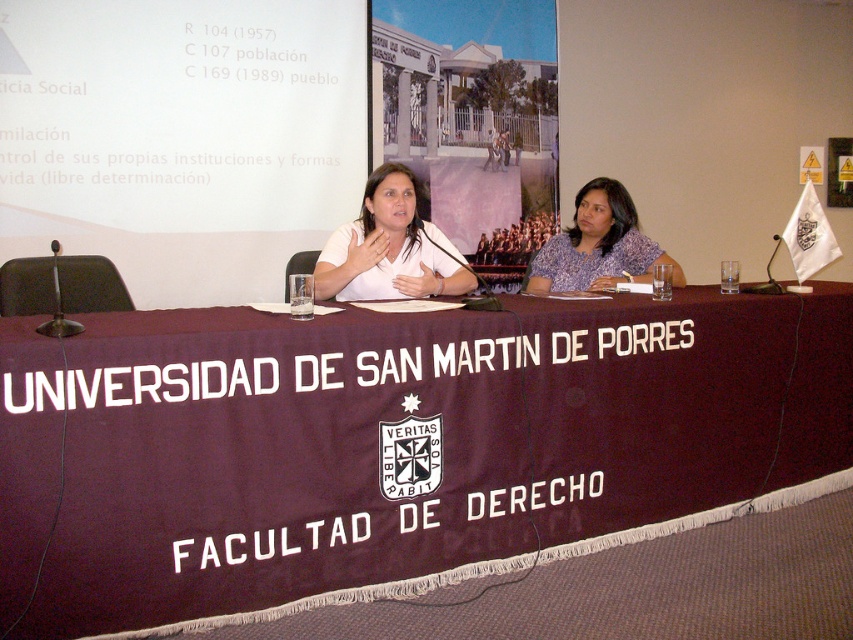
You are organizing a photo shoot for a university event and want to ensure proper framing. Given the scene described, which of the two individuals, the one wearing the white matte shirt at center or the one in the purple printed blouse at center, would require a wider frame to capture their clothing details adequately?

The purple printed blouse at center requires a wider frame because it has a greater width compared to the white matte shirt at center.

You are standing in the conference room at the Universidad de San Martin de Porres and want to place a 2.5 feet wide laptop on the maroon fabric table at center. Can the laptop fit on the table?

The maroon fabric table at center is 6.13 feet from viewer, so the distance from the viewer does not affect the table width. The laptop is 2.5 feet wide, but the table width is not provided. Therefore, it is impossible to determine if the laptop will fit based on the given information.

You are standing in front of the conference table at the Universidad de San Martin de Porres. You want to place a small plant on the table at the exact point marked as point (409, 388). If you are 1.7 meters tall, will the plant be visible to you without bending down?

The distance of point (409, 388) from the viewer is 2.34 meters. Since the plant is placed on the table at this point, and you are 1.7 meters tall, the plant will be visible without bending down as it is within a reasonable line of sight.